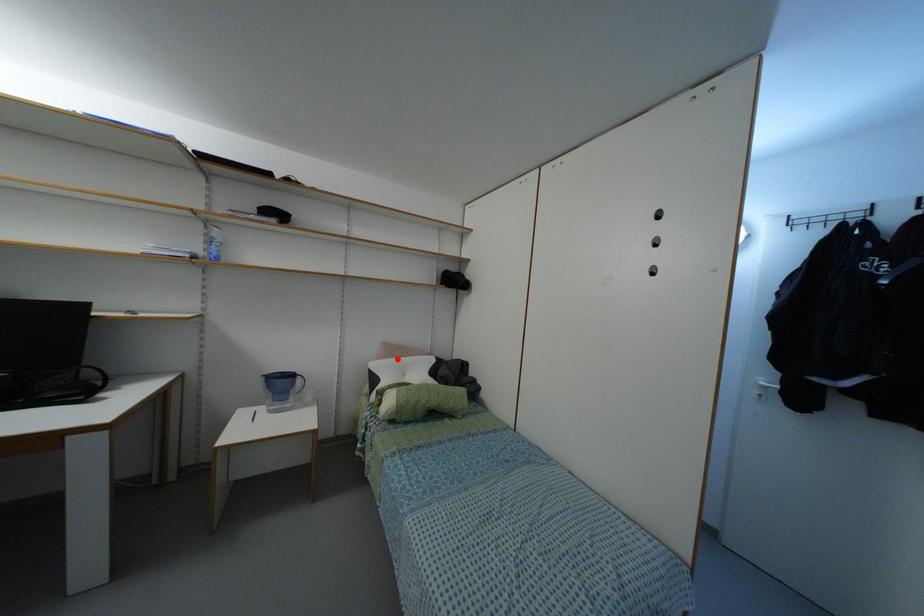
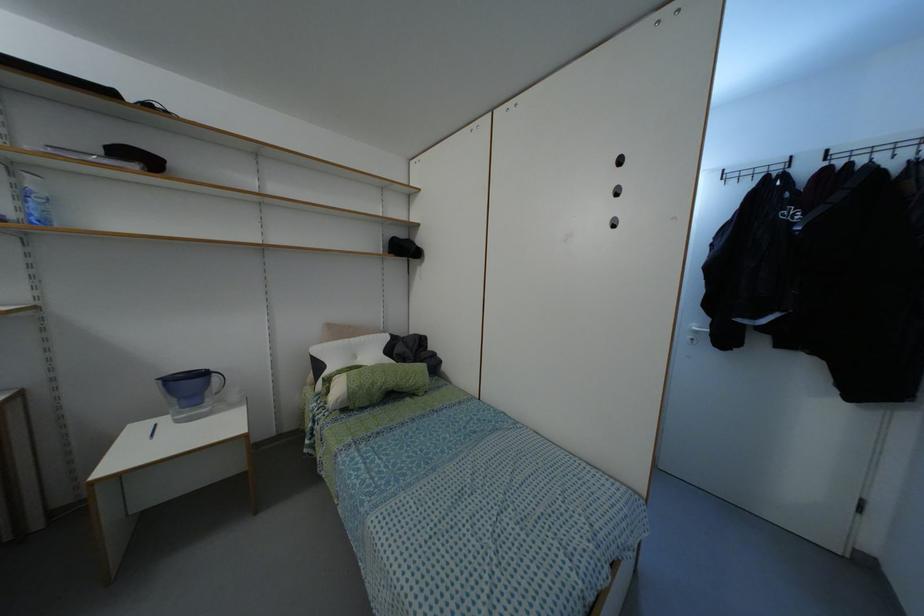
The point at the highlighted location is marked in the first image. Where is the corresponding point in the second image?

(345, 339)